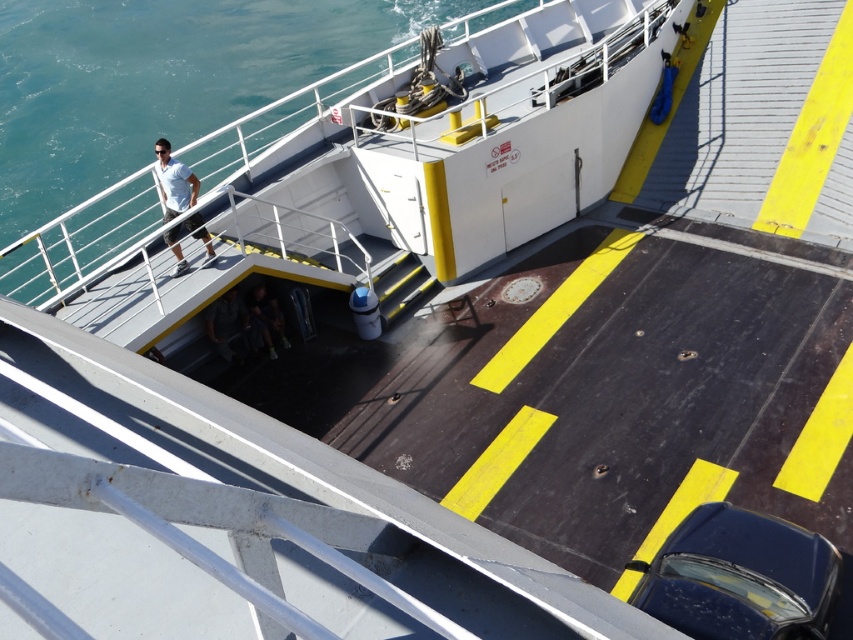
Question: Which object is farther from the camera taking this photo?

Choices:
 (A) dark gray fabric jacket at lower center
 (B) matte white shirt at upper left
 (C) dark brown leather jacket at lower center
 (D) blue water at upper left

Answer: (C)

Question: Is glossy dark blue car at lower right bigger than blue water at upper left?

Choices:
 (A) no
 (B) yes

Answer: (A)

Question: Is matte white shirt at upper left positioned at the back of dark brown leather jacket at lower center?

Choices:
 (A) yes
 (B) no

Answer: (B)

Question: Which is nearer to the dark gray fabric jacket at lower center?

Choices:
 (A) matte white shirt at upper left
 (B) dark brown leather jacket at lower center
 (C) blue water at upper left
 (D) glossy dark blue car at lower right

Answer: (B)

Question: Which object is positioned closest to the blue water at upper left?

Choices:
 (A) dark brown leather jacket at lower center
 (B) dark gray fabric jacket at lower center
 (C) glossy dark blue car at lower right

Answer: (B)

Question: Observing the image, what is the correct spatial positioning of glossy dark blue car at lower right in reference to dark gray fabric jacket at lower center?

Choices:
 (A) above
 (B) below

Answer: (B)